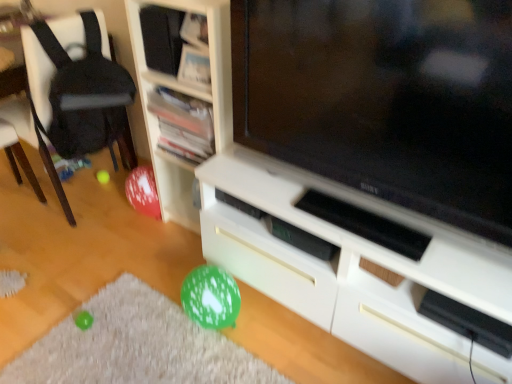
Locate an element on the screen. vacant space that is to the left of white matte cabinet at center is located at coordinates (169, 337).